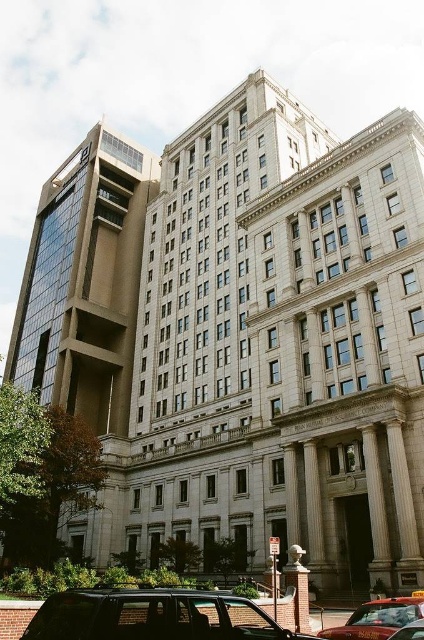
Is the position of matte black suv at lower center more distant than that of red metallic taxi cab at lower center?

No, matte black suv at lower center is in front of red metallic taxi cab at lower center.

Does matte black suv at lower center appear on the left side of red metallic taxi cab at lower center?

Indeed, matte black suv at lower center is positioned on the left side of red metallic taxi cab at lower center.

In the scene shown: Who is more forward, (161,625) or (373,602)?

Point (161,625) is more forward.

Where is `matte black suv at lower center`? matte black suv at lower center is located at coordinates (155, 616).

Who is positioned more to the right, red metallic taxi cab at lower center or metallic silver taxi at lower right?

red metallic taxi cab at lower center

Describe the element at coordinates (376, 618) in the screenshot. I see `red metallic taxi cab at lower center` at that location.

The image size is (424, 640). I want to click on red metallic taxi cab at lower center, so click(376, 618).

Looking at this image, does matte black suv at lower center have a greater width compared to metallic silver taxi at lower right?

Correct, the width of matte black suv at lower center exceeds that of metallic silver taxi at lower right.

Measure the distance between point (181,632) and camera.

They are 21.21 meters apart.

Identify the location of matte black suv at lower center. This screenshot has width=424, height=640. (155, 616).